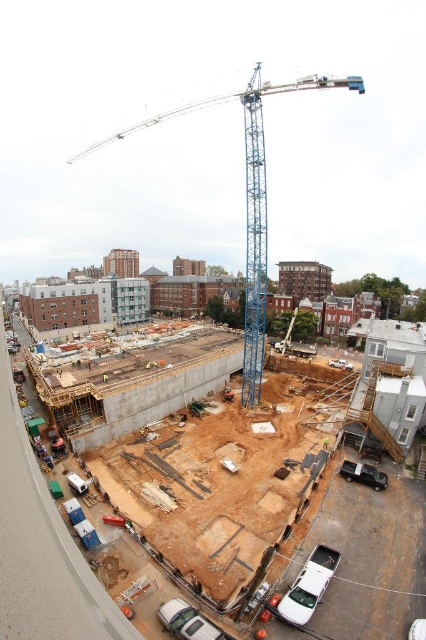
Question: Among these objects, which one is nearest to the camera?

Choices:
 (A) white matte truck at center
 (B) silver metallic car at lower center
 (C) yellow reflective safety vest at center

Answer: (B)

Question: Where is blue metallic crane at center located in relation to white matte truck at center in the image?

Choices:
 (A) above
 (B) below

Answer: (A)

Question: Can you confirm if blue metallic crane at center is smaller than yellow reflective safety vest at center?

Choices:
 (A) yes
 (B) no

Answer: (B)

Question: Which point is farther to the camera?

Choices:
 (A) (313, 604)
 (B) (348, 365)
 (C) (247, 200)

Answer: (C)

Question: Which point is closer to the camera taking this photo?

Choices:
 (A) (319, 593)
 (B) (356, 467)
 (C) (245, 97)

Answer: (A)

Question: Is blue metallic crane at center further to camera compared to silver metallic car at lower center?

Choices:
 (A) no
 (B) yes

Answer: (B)